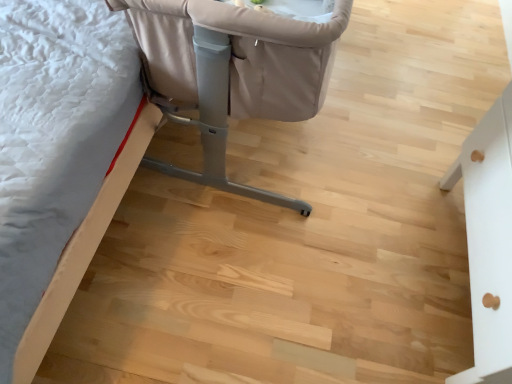
Where is `free area behind white matte drawer at right, which appears as the third furniture when viewed from the left`? The height and width of the screenshot is (384, 512). free area behind white matte drawer at right, which appears as the third furniture when viewed from the left is located at coordinates (407, 134).